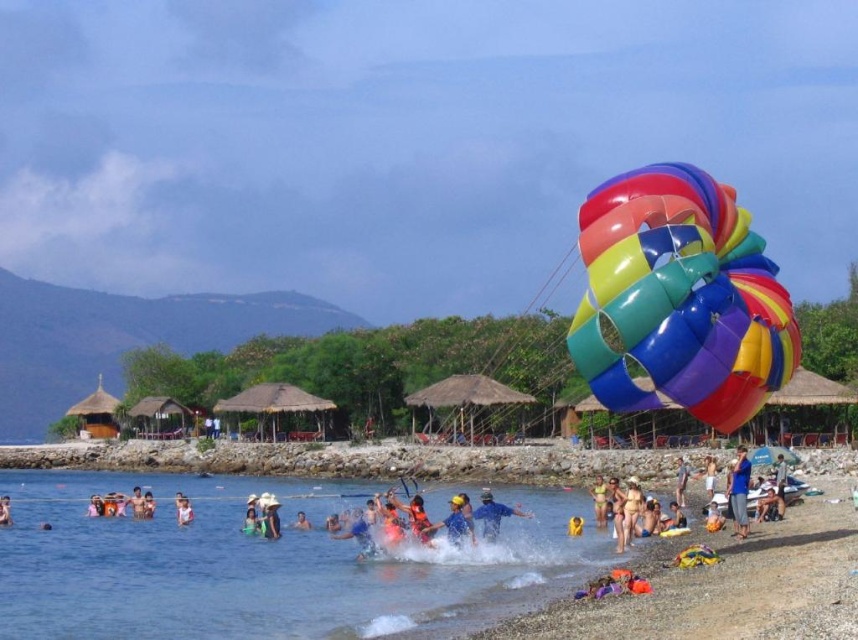
You are a photographer standing at the shore. You want to capture a photo that includes both the shiny plastic parachute at right and the multicolored fabric people at lower right. Which object should you position closer to the center of your camera frame to ensure both are fully visible?

To ensure both the shiny plastic parachute at right and the multicolored fabric people at lower right are fully visible in your photo, position the shiny plastic parachute at right closer to the center of your camera frame. Since it might be wider than the multicolored fabric people at lower right, centering it would help accommodate its larger size within the frame.

You are a photographer at the beach scene. You want to capture a photo that includes both the blue fabric person at center and the blue fabric swimmer at lower left. Which one will appear smaller in the photo?

The blue fabric person at center will appear smaller in the photo because they occupy less space than the blue fabric swimmer at lower left.